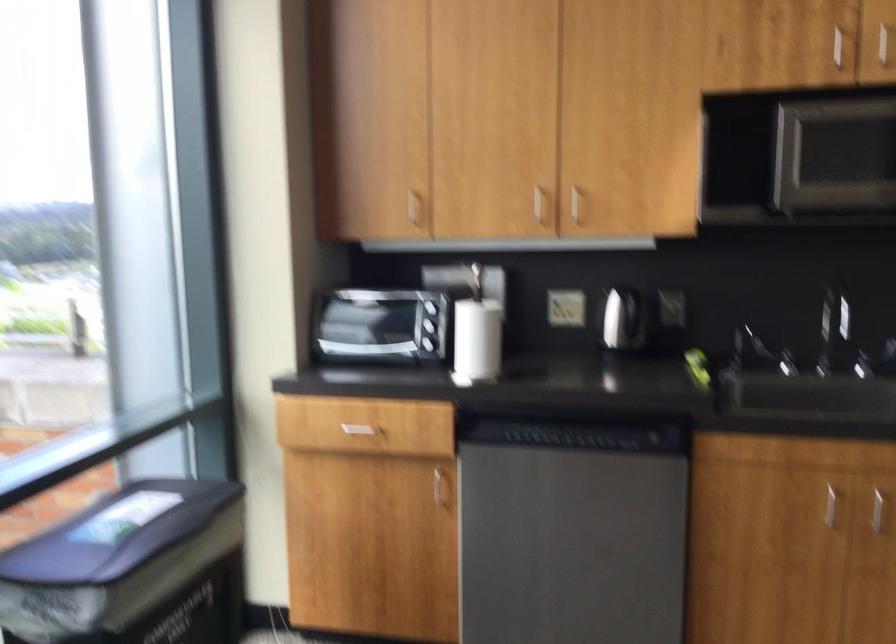
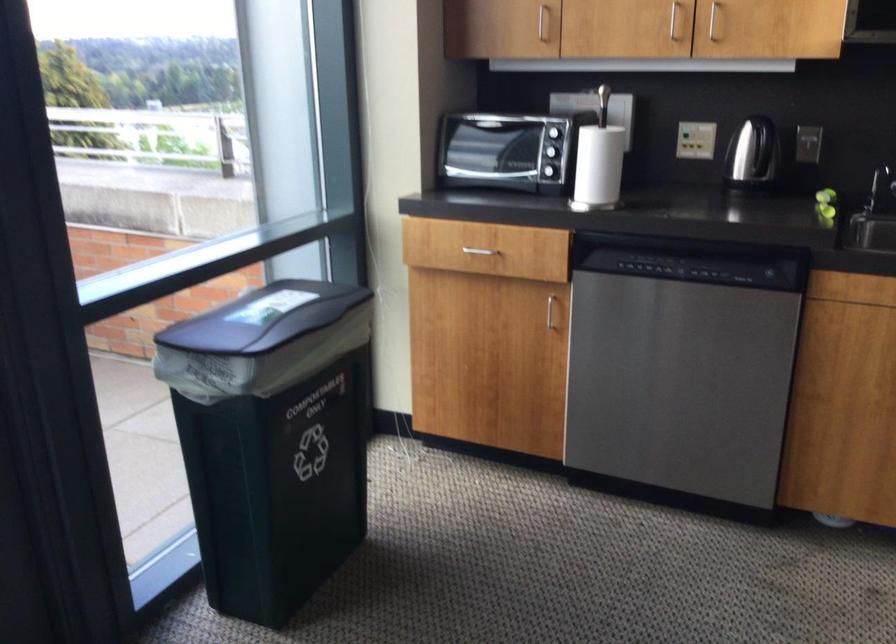
Find the pixel in the second image that matches point (359, 419) in the first image.

(474, 241)